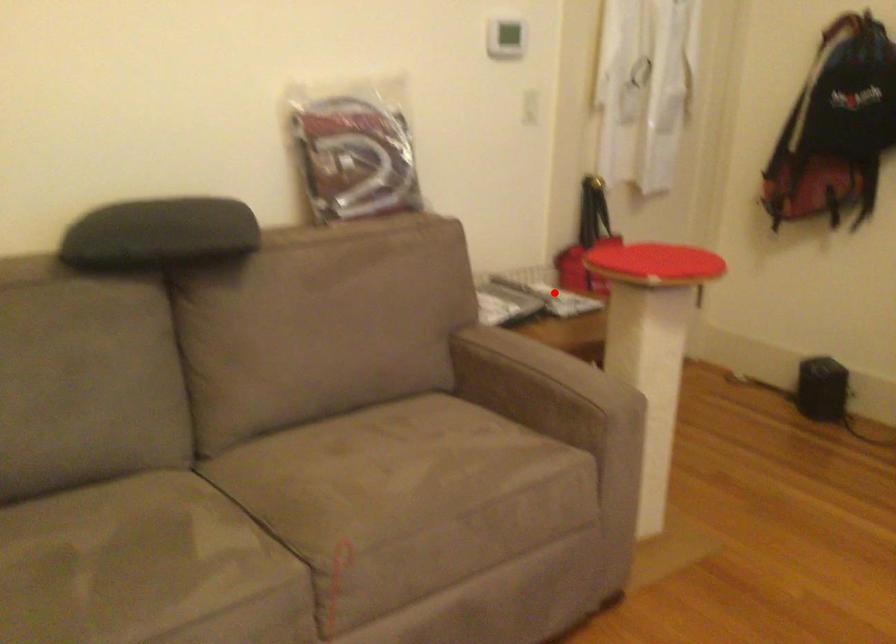
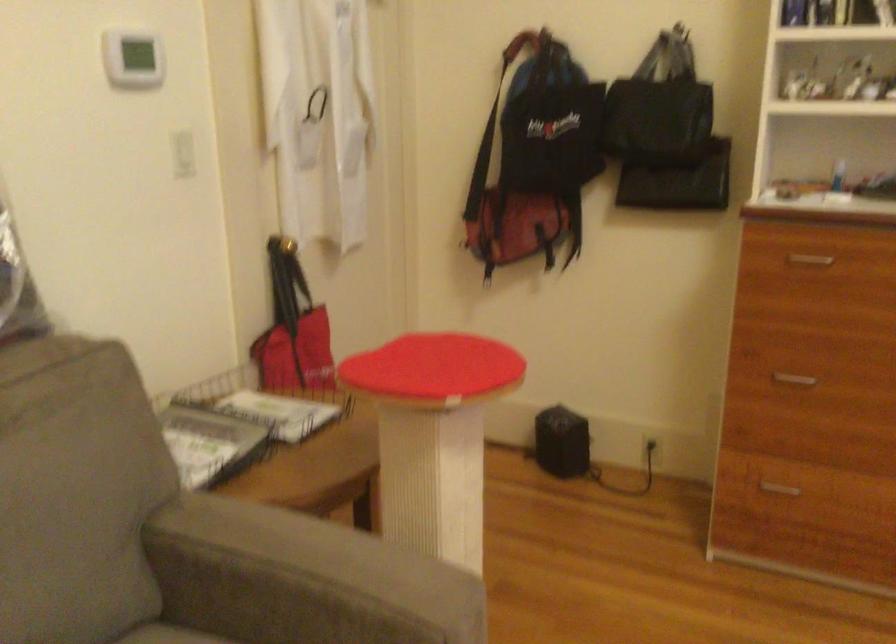
In the second image, find the point that corresponds to the highlighted location in the first image.

(265, 402)